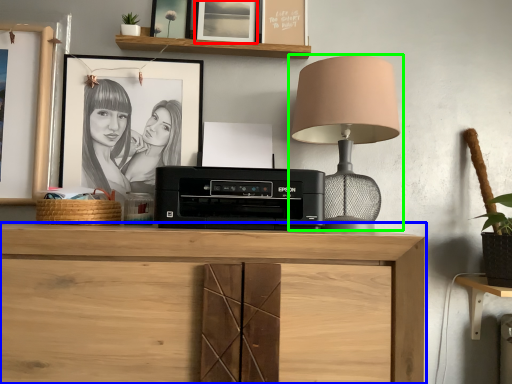
Question: Which object is the closest to the picture frame (highlighted by a red box)? Choose among these: chest of drawers (highlighted by a blue box) or lamp (highlighted by a green box).

Choices:
 (A) chest of drawers
 (B) lamp

Answer: (B)